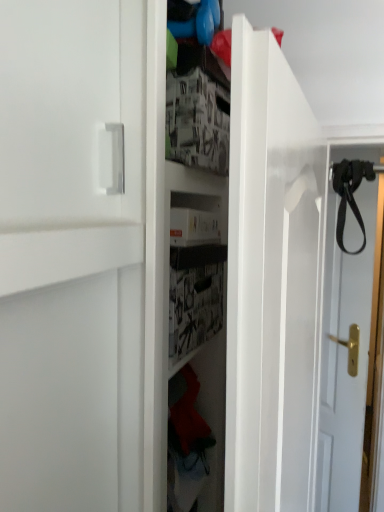
Question: From the image's perspective, does black leather strap at upper right appear lower than black leather strap at right?

Choices:
 (A) yes
 (B) no

Answer: (B)

Question: Does black leather strap at upper right have a larger size compared to black leather strap at right?

Choices:
 (A) no
 (B) yes

Answer: (A)

Question: Is black leather strap at upper right located outside black leather strap at right?

Choices:
 (A) yes
 (B) no

Answer: (A)

Question: From a real-world perspective, is black leather strap at upper right over black leather strap at right?

Choices:
 (A) yes
 (B) no

Answer: (A)

Question: Can you confirm if black leather strap at upper right is taller than black leather strap at right?

Choices:
 (A) yes
 (B) no

Answer: (B)

Question: Can you confirm if black leather strap at upper right is thinner than black leather strap at right?

Choices:
 (A) no
 (B) yes

Answer: (B)

Question: From a real-world perspective, is black leather strap at right located higher than black leather strap at upper right?

Choices:
 (A) yes
 (B) no

Answer: (B)

Question: Is black leather strap at right beside black leather strap at upper right?

Choices:
 (A) no
 (B) yes

Answer: (A)

Question: Can you confirm if black leather strap at right is thinner than black leather strap at upper right?

Choices:
 (A) no
 (B) yes

Answer: (A)

Question: Considering the relative sizes of black leather strap at right and black leather strap at upper right in the image provided, is black leather strap at right shorter than black leather strap at upper right?

Choices:
 (A) no
 (B) yes

Answer: (A)

Question: From the image's perspective, is black leather strap at right located beneath black leather strap at upper right?

Choices:
 (A) yes
 (B) no

Answer: (A)

Question: Can you confirm if black leather strap at right is smaller than black leather strap at upper right?

Choices:
 (A) no
 (B) yes

Answer: (A)

Question: In the image, is black leather strap at upper right on the left side or the right side of black leather strap at right?

Choices:
 (A) left
 (B) right

Answer: (A)